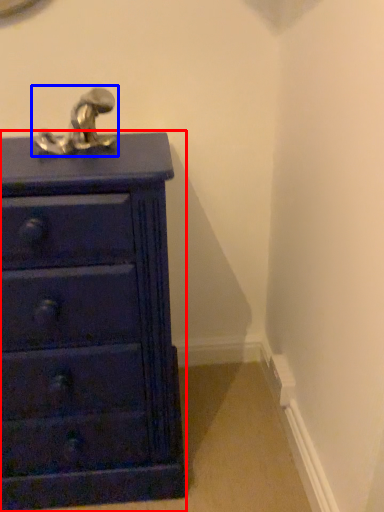
Question: Among these objects, which one is nearest to the camera, chest of drawers (highlighted by a red box) or tap (highlighted by a blue box)?

Choices:
 (A) chest of drawers
 (B) tap

Answer: (A)